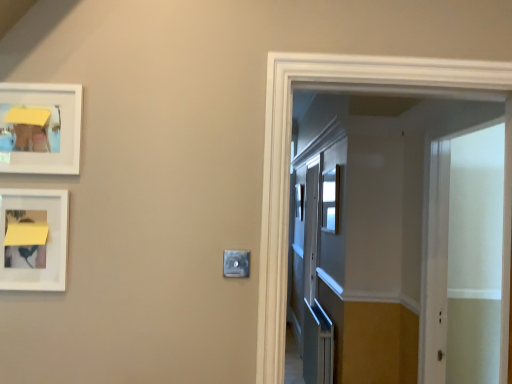
Question: From a real-world perspective, relative to white translucent screen door at right, is satin silver switch at center vertically above or below?

Choices:
 (A) below
 (B) above

Answer: (B)

Question: Does point (242, 274) appear closer or farther from the camera than point (486, 377)?

Choices:
 (A) farther
 (B) closer

Answer: (B)

Question: Which is farther from the white matte picture frame at upper left, which appears as the second picture frame when ordered from the bottom?

Choices:
 (A) white matte picture frame at left, marked as the 1th picture frame in a bottom-to-top arrangement
 (B) white glossy elevator at center
 (C) clear glass window at center
 (D) satin silver switch at center
 (E) white translucent screen door at right

Answer: (E)

Question: Estimate the real-world distances between objects in this image. Which object is closer to the clear glass window at center?

Choices:
 (A) white translucent screen door at right
 (B) white matte picture frame at upper left, which appears as the second picture frame when ordered from the bottom
 (C) white glossy elevator at center
 (D) white matte picture frame at left, which appears as the second picture frame when viewed from the top
 (E) satin silver switch at center

Answer: (A)